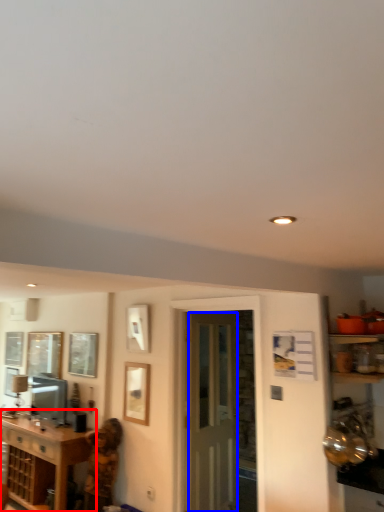
Question: Which of the following is the farthest to the observer, cabinetry (highlighted by a red box) or screen door (highlighted by a blue box)?

Choices:
 (A) cabinetry
 (B) screen door

Answer: (A)